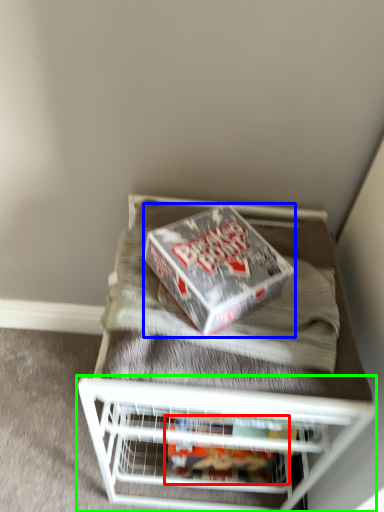
Question: Considering the real-world distances, which object is farthest from package (highlighted by a red box)? box (highlighted by a blue box) or shelf (highlighted by a green box)?

Choices:
 (A) box
 (B) shelf

Answer: (A)